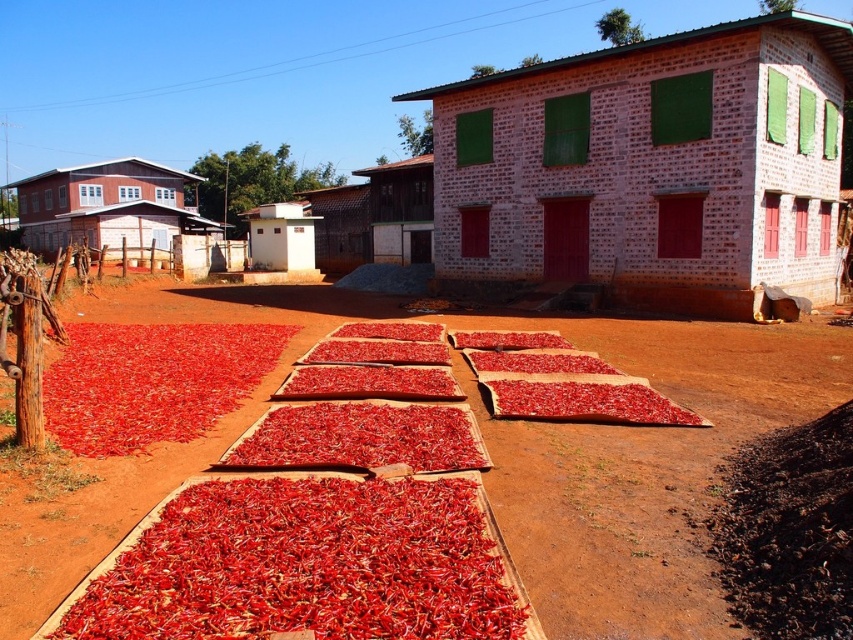
You are standing at the edge of the dirt ground where the red chili peppers are drying. You need to walk to the brick wall house at center. According to the coordinates provided, in which direction should you head from your current position?

The brick wall house at center is located at point (650,168), so you should head towards the center of the image from your current position at the edge of the dirt ground.